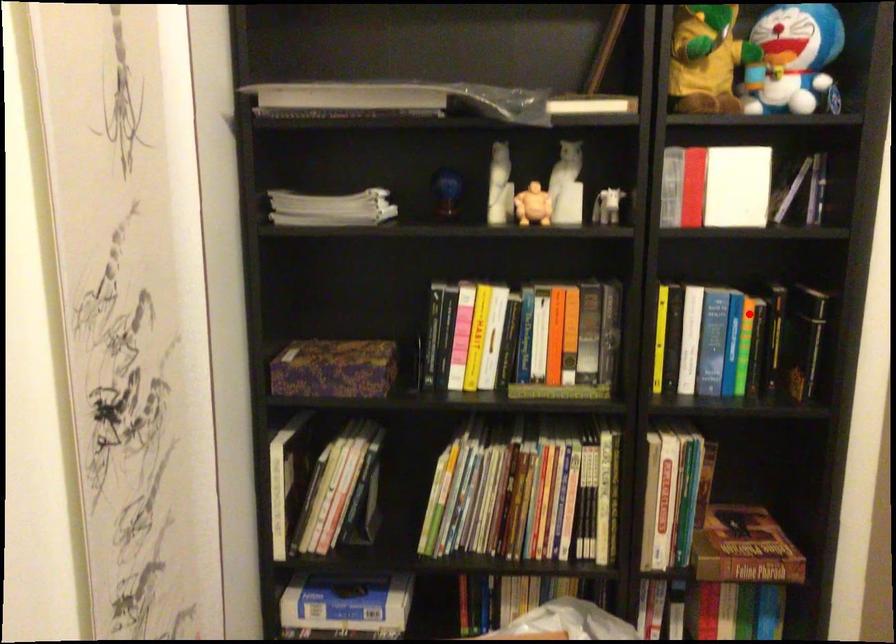
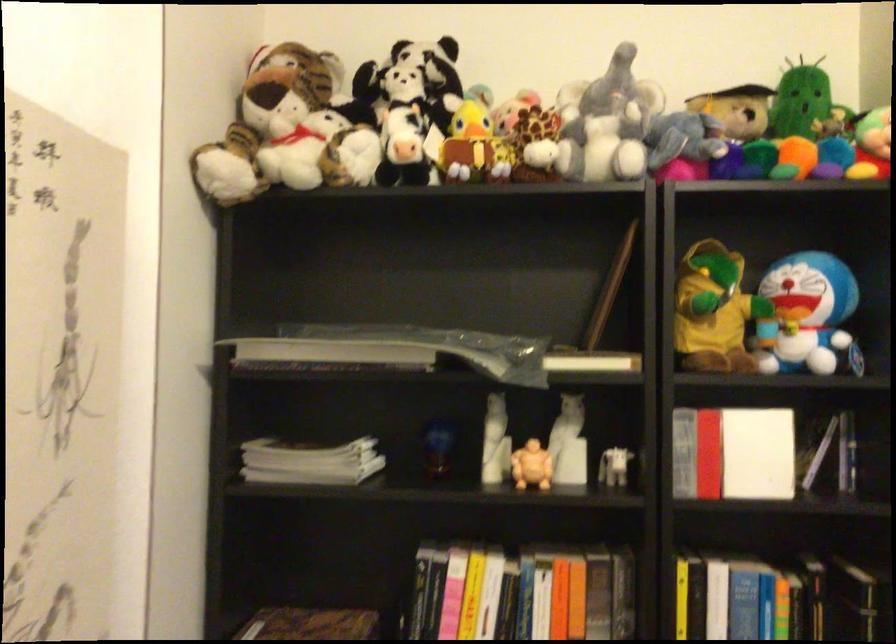
Locate, in the second image, the point that corresponds to the highlighted location in the first image.

(780, 599)